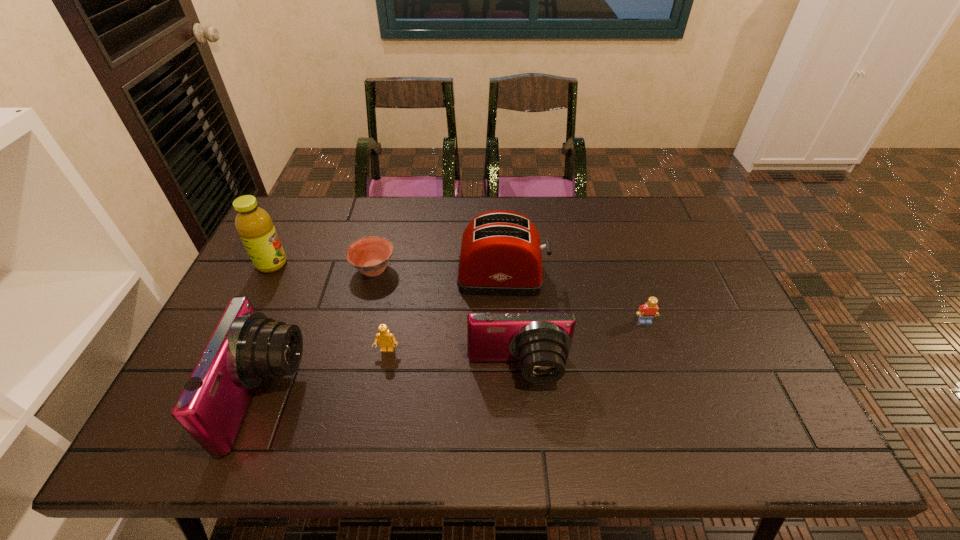
The width and height of the screenshot is (960, 540). What are the coordinates of `vacant place for an extra camera on the right` in the screenshot? It's located at (748, 349).